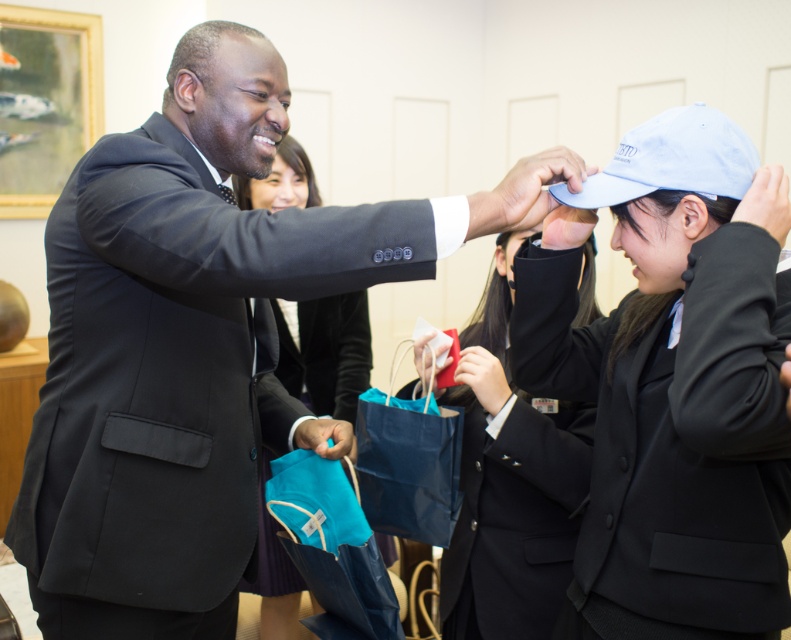
Can you confirm if blue paper bag at center is smaller than light blue fabric baseball cap at upper right?

No, blue paper bag at center is not smaller than light blue fabric baseball cap at upper right.

Does blue paper bag at center have a greater width compared to light blue fabric baseball cap at upper right?

No, blue paper bag at center is not wider than light blue fabric baseball cap at upper right.

I want to click on blue paper bag at center, so click(407, 465).

Where is `blue paper bag at center`? blue paper bag at center is located at coordinates (407, 465).

Who is taller, black matte business suit at center or light blue fabric baseball cap at upper right?

Standing taller between the two is black matte business suit at center.

Who is positioned more to the right, black matte business suit at center or light blue fabric baseball cap at upper right?

light blue fabric baseball cap at upper right

Is point (774, 442) closer to camera compared to point (578, 204)?

That is True.

At what (x,y) coordinates should I click in order to perform the action: click on black matte business suit at center. Please return your answer as a coordinate pair (x, y). This screenshot has height=640, width=791. Looking at the image, I should click on (676, 433).

Does matte black blazer at center appear on the left side of matte blue shopping bag at center?

Indeed, matte black blazer at center is positioned on the left side of matte blue shopping bag at center.

Is matte black blazer at center closer to camera compared to matte blue shopping bag at center?

No, matte black blazer at center is behind matte blue shopping bag at center.

Between point (339, 307) and point (294, 483), which one is positioned in front?

Point (294, 483) is in front.

You are a GUI agent. You are given a task and a screenshot of the screen. Output one action in this format:
    pyautogui.click(x=<x>, y=<y>)
    Task: Click on the matte black blazer at center
    The image size is (791, 640).
    Given the screenshot: What is the action you would take?
    pyautogui.click(x=324, y=352)